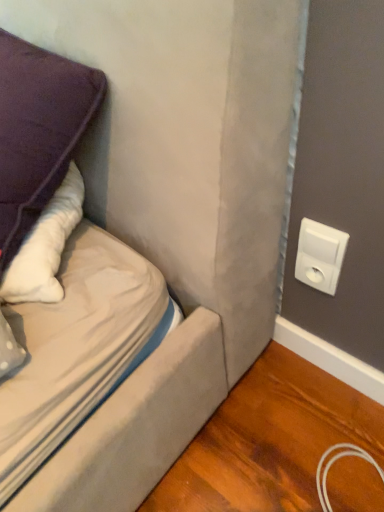
Describe the element at coordinates (38, 131) in the screenshot. This screenshot has height=512, width=384. I see `purple fabric pillow at upper left` at that location.

At what (x,y) coordinates should I click in order to perform the action: click on purple fabric pillow at upper left. Please return your answer as a coordinate pair (x, y). This screenshot has height=512, width=384. Looking at the image, I should click on (38, 131).

Measure the distance between point (65, 130) and camera.

Point (65, 130) and camera are 23.46 inches apart from each other.

The height and width of the screenshot is (512, 384). Describe the element at coordinates (320, 255) in the screenshot. I see `white plastic outlet at upper right` at that location.

Find the location of `white plastic outlet at upper right`. white plastic outlet at upper right is located at coordinates (320, 255).

Locate an element on the screen. This screenshot has width=384, height=512. purple fabric pillow at upper left is located at coordinates (38, 131).

Is purple fabric pillow at upper left to the right of white plastic outlet at upper right from the viewer's perspective?

Incorrect, purple fabric pillow at upper left is not on the right side of white plastic outlet at upper right.

Between purple fabric pillow at upper left and white plastic outlet at upper right, which one is positioned in front?

purple fabric pillow at upper left is in front.

Does point (21, 155) lie in front of point (301, 253)?

That is True.

From the image's perspective, which object appears higher, purple fabric pillow at upper left or white plastic outlet at upper right?

From the image's view, purple fabric pillow at upper left is above.

From a real-world perspective, is purple fabric pillow at upper left located higher than white plastic outlet at upper right?

Yes, from a real-world perspective, purple fabric pillow at upper left is above white plastic outlet at upper right.

Is purple fabric pillow at upper left wider or thinner than white plastic outlet at upper right?

purple fabric pillow at upper left is wider than white plastic outlet at upper right.

Between purple fabric pillow at upper left and white plastic outlet at upper right, which one has less height?

Standing shorter between the two is white plastic outlet at upper right.

Considering the sizes of objects purple fabric pillow at upper left and white plastic outlet at upper right in the image provided, who is smaller, purple fabric pillow at upper left or white plastic outlet at upper right?

white plastic outlet at upper right is smaller.

Consider the image. Can we say purple fabric pillow at upper left lies outside white plastic outlet at upper right?

Yes.

Can you see purple fabric pillow at upper left touching white plastic outlet at upper right?

purple fabric pillow at upper left is not next to white plastic outlet at upper right, and they're not touching.

Does purple fabric pillow at upper left turn towards white plastic outlet at upper right?

No.

How many degrees apart are the facing directions of purple fabric pillow at upper left and white plastic outlet at upper right?

There is a 4.96-degree angle between the facing directions of purple fabric pillow at upper left and white plastic outlet at upper right.

Measure the distance from purple fabric pillow at upper left to white plastic outlet at upper right.

purple fabric pillow at upper left and white plastic outlet at upper right are 18.64 inches apart from each other.

You are a GUI agent. You are given a task and a screenshot of the screen. Output one action in this format:
    pyautogui.click(x=<x>, y=<y>)
    Task: Click on the pillow above the white plastic outlet at upper right (from a real-world perspective)
    
    Given the screenshot: What is the action you would take?
    pyautogui.click(x=38, y=131)

Does white plastic outlet at upper right appear on the right side of purple fabric pillow at upper left?

Yes, white plastic outlet at upper right is to the right of purple fabric pillow at upper left.

Looking at this image, which object is more forward, white plastic outlet at upper right or purple fabric pillow at upper left?

purple fabric pillow at upper left.

Is point (343, 234) farther from camera compared to point (52, 66)?

Yes, it is behind point (52, 66).

From the image's perspective, is white plastic outlet at upper right on top of purple fabric pillow at upper left?

Incorrect, from the image's perspective, white plastic outlet at upper right is lower than purple fabric pillow at upper left.

From a real-world perspective, is white plastic outlet at upper right on purple fabric pillow at upper left?

No, from a real-world perspective, white plastic outlet at upper right is not over purple fabric pillow at upper left

Can you confirm if white plastic outlet at upper right is thinner than purple fabric pillow at upper left?

Indeed, white plastic outlet at upper right has a lesser width compared to purple fabric pillow at upper left.

Considering the sizes of objects white plastic outlet at upper right and purple fabric pillow at upper left in the image provided, who is taller, white plastic outlet at upper right or purple fabric pillow at upper left?

With more height is purple fabric pillow at upper left.

Can you confirm if white plastic outlet at upper right is smaller than purple fabric pillow at upper left?

Correct, white plastic outlet at upper right occupies less space than purple fabric pillow at upper left.

Does white plastic outlet at upper right contain purple fabric pillow at upper left?

No, white plastic outlet at upper right does not contain purple fabric pillow at upper left.

Is white plastic outlet at upper right far away from purple fabric pillow at upper left?

No, white plastic outlet at upper right is not far away from purple fabric pillow at upper left.

Is purple fabric pillow at upper left at the back of white plastic outlet at upper right?

No, purple fabric pillow at upper left is not at the back of white plastic outlet at upper right.

Consider the image. How different are the orientations of white plastic outlet at upper right and purple fabric pillow at upper left in degrees?

They differ by 4.96 degrees in their facing directions.

Measure the distance between white plastic outlet at upper right and purple fabric pillow at upper left.

white plastic outlet at upper right is 47.34 centimeters away from purple fabric pillow at upper left.

Locate an element on the screen. pillow above the white plastic outlet at upper right (from the image's perspective) is located at coordinates (38, 131).

Image resolution: width=384 pixels, height=512 pixels. I want to click on electric outlet below the purple fabric pillow at upper left (from the image's perspective), so click(x=320, y=255).

The image size is (384, 512). Identify the location of electric outlet that is behind the purple fabric pillow at upper left. (320, 255).